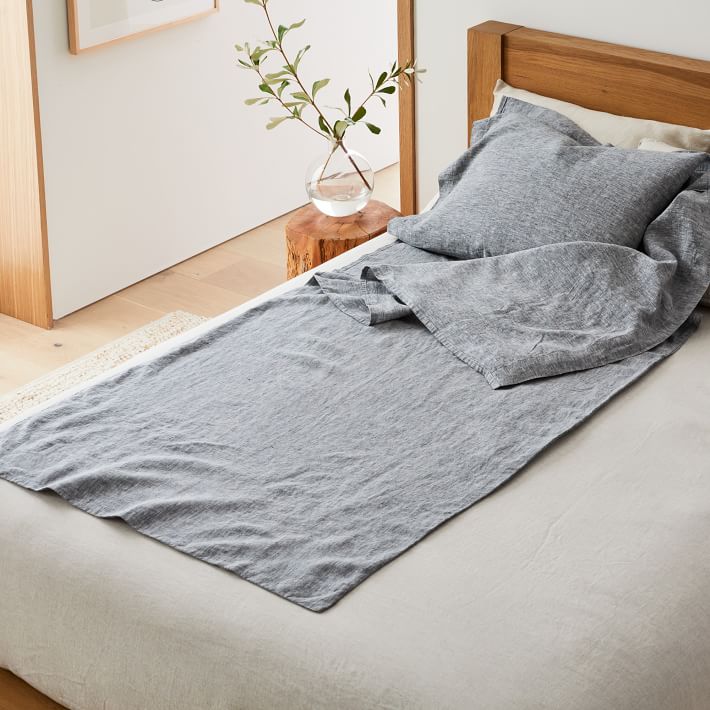
This screenshot has height=710, width=710. Find the location of `picture`. picture is located at coordinates (103, 18).